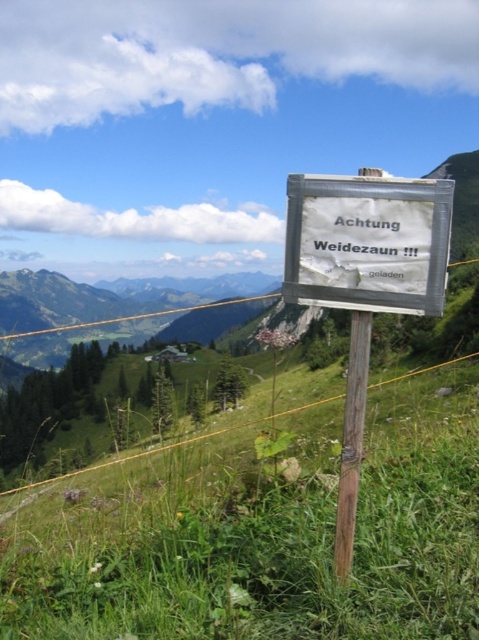
You are a hiker who wants to place a 2.5 meter long tent between the green grassy at center and the white paper sign at center. Is there enough space to set up the tent without overlapping either object?

The distance between the green grassy at center and the white paper sign at center is 7.35 meters. Since the tent is only 2.5 meters long, there is sufficient space to place it between them without overlapping either object.